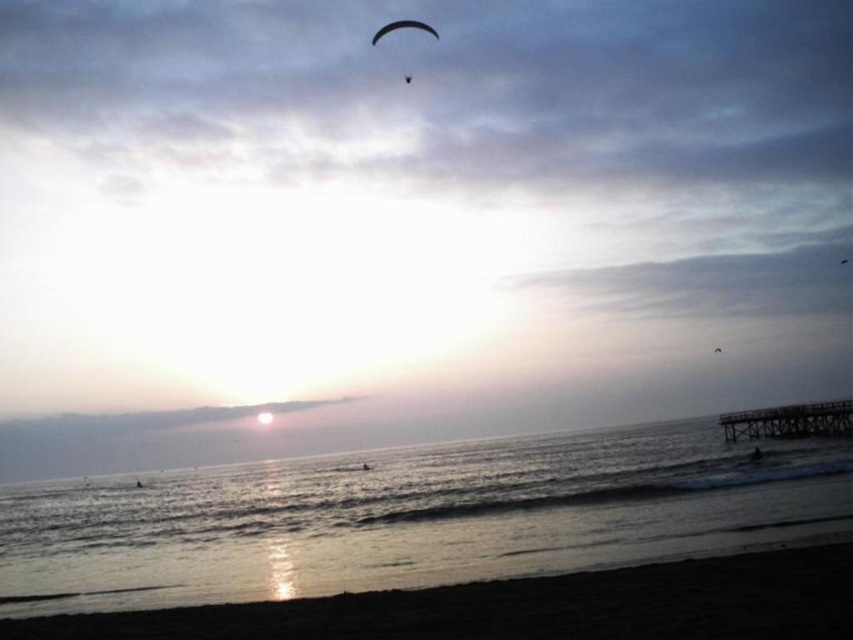
You are standing on the beach and want to walk from point (279, 481) to point (190, 636). Which direction should you face to move towards the second point?

Since point (279, 481) is closer to you than point (190, 636), you should face away from the shore towards the water to move towards the second point.

You are standing on the beach and want to walk to the two points marked in the image. The first point is at coordinates point [364,561] and the second is at point [392,24]. Which point will you reach first if you start walking from your current position?

You will reach point [364,561] first because it is closer to you than point [392,24].

You are standing on the beach and want to take a photo of the glistening water at lower center. According to the coordinates provided, where should you aim your camera to capture it?

You should aim your camera at point 0.808 on the horizontal axis and 0.485 on the vertical axis to capture the glistening water at lower center.